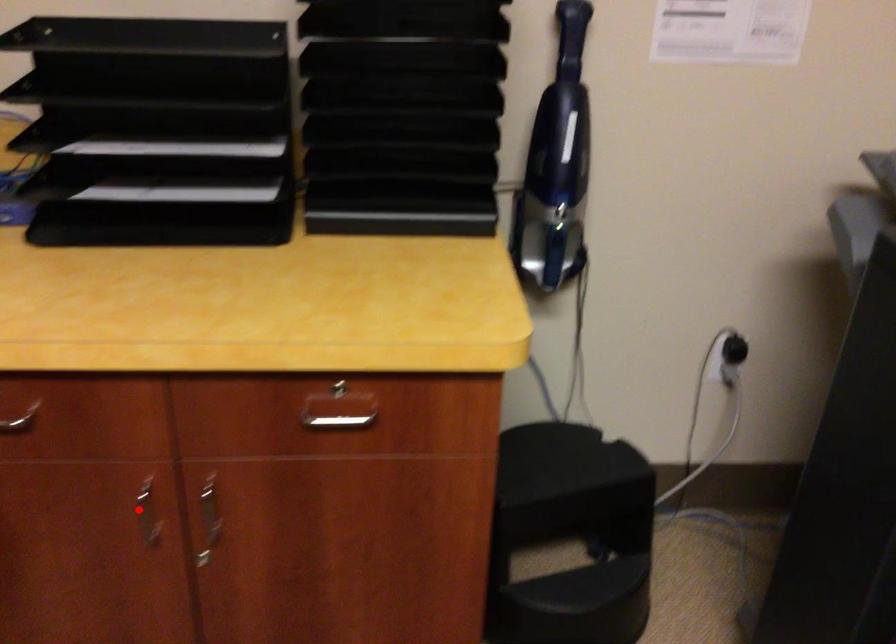
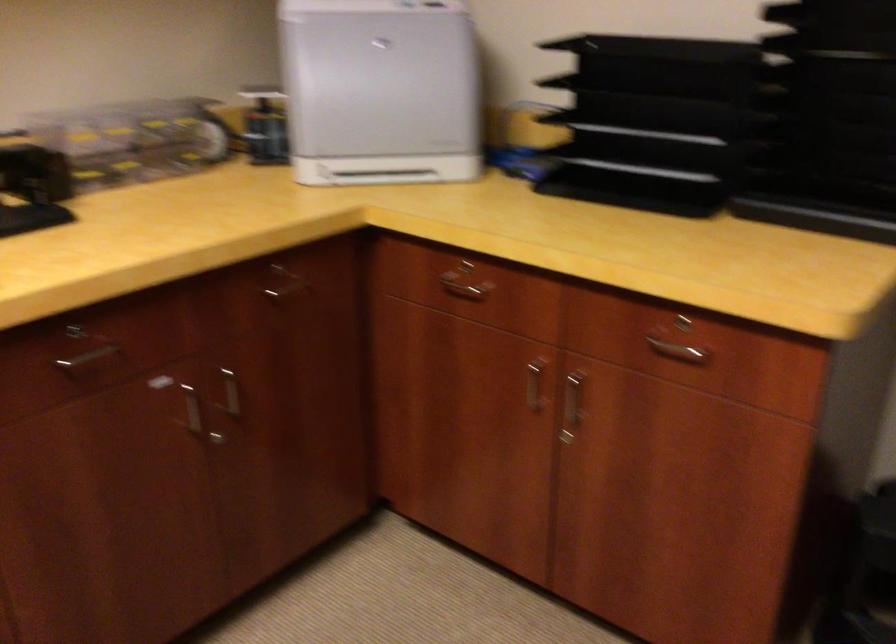
Locate, in the second image, the point that corresponds to the highlighted location in the first image.

(533, 386)